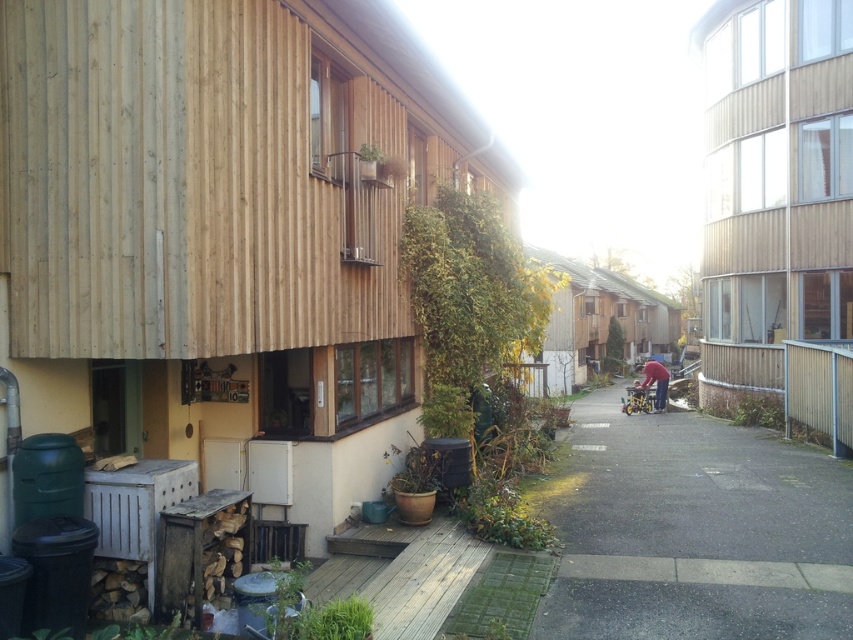
Does pink fabric at center-right appear on the left side of metallic silver baby carriage at center-right?

No, pink fabric at center-right is not to the left of metallic silver baby carriage at center-right.

Who is more distant from viewer, (654, 371) or (624, 410)?

Point (624, 410)

Where is `pink fabric at center-right`? The height and width of the screenshot is (640, 853). pink fabric at center-right is located at coordinates (656, 381).

Does point (712, 561) come closer to viewer compared to point (648, 381)?

That is True.

Does smooth asphalt alley at center have a lesser width compared to pink fabric at center-right?

Correct, smooth asphalt alley at center's width is less than pink fabric at center-right's.

The image size is (853, 640). Describe the element at coordinates (694, 531) in the screenshot. I see `smooth asphalt alley at center` at that location.

Find the location of a particular element. smooth asphalt alley at center is located at coordinates pyautogui.click(x=694, y=531).

Which is behind, point (581, 509) or point (645, 390)?

Point (645, 390)

Measure the distance from smooth asphalt alley at center to metallic silver baby carriage at center-right.

A distance of 10.32 meters exists between smooth asphalt alley at center and metallic silver baby carriage at center-right.

Describe the element at coordinates (694, 531) in the screenshot. I see `smooth asphalt alley at center` at that location.

This screenshot has width=853, height=640. I want to click on smooth asphalt alley at center, so [x=694, y=531].